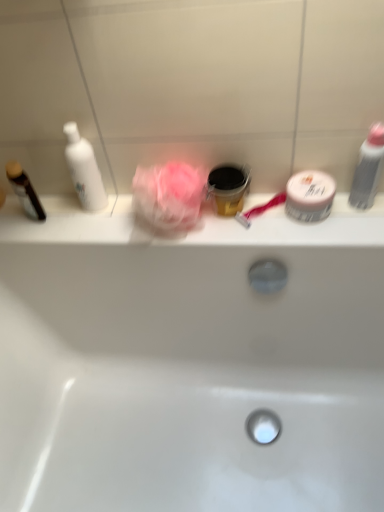
Question: From a real-world perspective, is white glossy bathtub at center below black plastic cup at center, which is counted as the second toiletry, starting from the left?

Choices:
 (A) no
 (B) yes

Answer: (B)

Question: Is white glossy bathtub at center outside of black plastic cup at center, which is counted as the second toiletry, starting from the left?

Choices:
 (A) yes
 (B) no

Answer: (A)

Question: Is white glossy bathtub at center shorter than black plastic cup at center, which is counted as the second toiletry, starting from the left?

Choices:
 (A) no
 (B) yes

Answer: (A)

Question: Is white glossy bathtub at center thinner than black plastic cup at center, arranged as the third toiletry when viewed from the right?

Choices:
 (A) yes
 (B) no

Answer: (B)

Question: From the image's perspective, is white glossy bathtub at center located above black plastic cup at center, arranged as the third toiletry when viewed from the right?

Choices:
 (A) yes
 (B) no

Answer: (B)

Question: From the image's perspective, is white glossy bathtub at center located above or below black plastic cup at center, which is counted as the second toiletry, starting from the left?

Choices:
 (A) below
 (B) above

Answer: (A)

Question: From a real-world perspective, is white glossy bathtub at center physically located above or below black plastic cup at center, which is counted as the second toiletry, starting from the left?

Choices:
 (A) below
 (B) above

Answer: (A)

Question: Is white glossy bathtub at center in front of or behind black plastic cup at center, which is counted as the second toiletry, starting from the left, in the image?

Choices:
 (A) behind
 (B) front

Answer: (B)

Question: Is white glossy bathtub at center taller or shorter than black plastic cup at center, arranged as the third toiletry when viewed from the right?

Choices:
 (A) short
 (B) tall

Answer: (B)

Question: In the image, is gray matte bottle at right, the 1th toiletry in the right-to-left sequence, positioned in front of or behind dark brown glossy bottle at left, which appears as the 4th toiletry when viewed from the right?

Choices:
 (A) front
 (B) behind

Answer: (A)

Question: From the image's perspective, relative to dark brown glossy bottle at left, which appears as the 4th toiletry when viewed from the right, is gray matte bottle at right, the 4th toiletry positioned from the left, above or below?

Choices:
 (A) above
 (B) below

Answer: (A)

Question: Is gray matte bottle at right, the 4th toiletry positioned from the left, situated inside dark brown glossy bottle at left, which is the 1th toiletry from left to right, or outside?

Choices:
 (A) inside
 (B) outside

Answer: (B)

Question: Looking at the image, does gray matte bottle at right, the 1th toiletry in the right-to-left sequence, seem bigger or smaller compared to dark brown glossy bottle at left, which appears as the 4th toiletry when viewed from the right?

Choices:
 (A) big
 (B) small

Answer: (B)

Question: Is point (244, 181) positioned closer to the camera than point (304, 189)?

Choices:
 (A) closer
 (B) farther

Answer: (B)

Question: Relative to white matte jar at right, which appears as the second toiletry when viewed from the right, is black plastic cup at center, which is counted as the second toiletry, starting from the left, in front or behind?

Choices:
 (A) front
 (B) behind

Answer: (B)